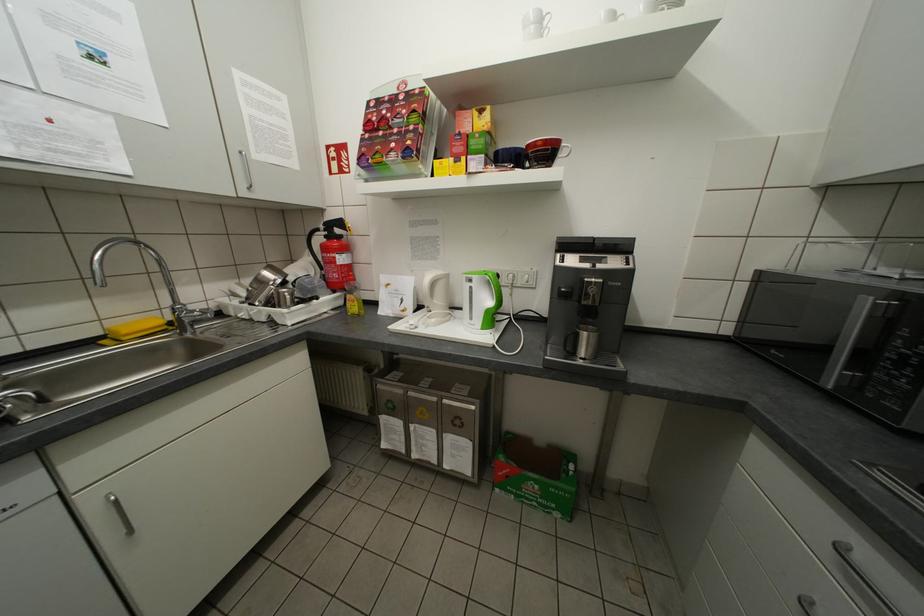
Find where to lift the dark blue mug. Please return your answer as a coordinate pair (x, y).

(509, 156)